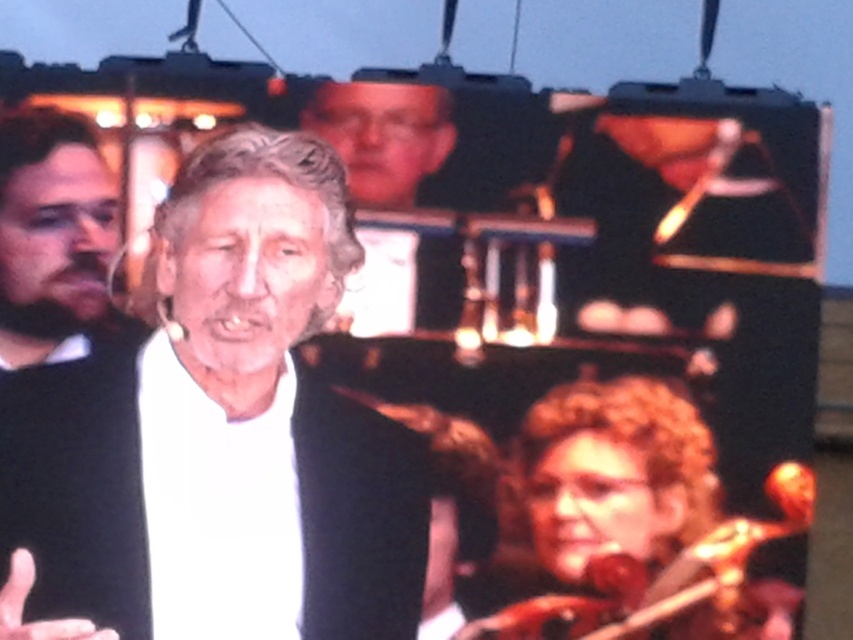
Does curly blonde hair at lower right lie behind white matte hand at lower left?

Yes, curly blonde hair at lower right is further from the viewer.

Who is lower down, curly blonde hair at lower right or white matte hand at lower left?

Positioned lower is curly blonde hair at lower right.

Who is more forward, (x=550, y=560) or (x=15, y=616)?

Positioned in front is point (x=15, y=616).

I want to click on curly blonde hair at lower right, so [610, 500].

Is white matte shirt at center behind curly blonde hair at lower right?

That is False.

Image resolution: width=853 pixels, height=640 pixels. What are the coordinates of `white matte shirt at center` in the screenshot? It's located at (219, 433).

Does curly blonde hair at lower right appear on the left side of black matte sweater at left?

No, curly blonde hair at lower right is not to the left of black matte sweater at left.

Is curly blonde hair at lower right further to the viewer compared to black matte sweater at left?

Yes, curly blonde hair at lower right is further from the viewer.

The image size is (853, 640). Find the location of `curly blonde hair at lower right`. curly blonde hair at lower right is located at coordinates (610, 500).